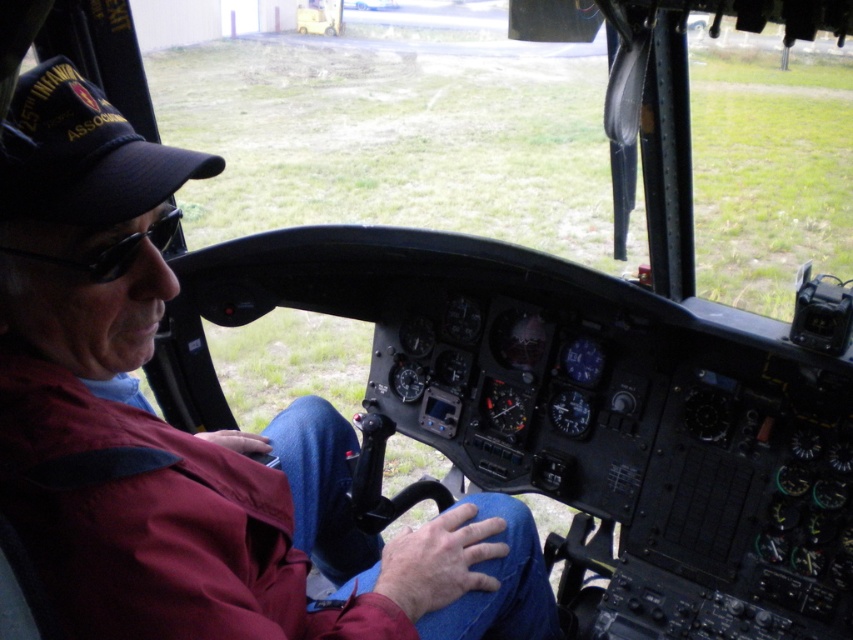
Based on the photo, does black fabric cap at upper left appear over black plastic goggles at left?

Yes, black fabric cap at upper left is above black plastic goggles at left.

Is black fabric cap at upper left positioned at the back of black plastic goggles at left?

That is False.

Identify the location of black fabric cap at upper left. (83, 154).

Where is `black fabric cap at upper left`? This screenshot has width=853, height=640. black fabric cap at upper left is located at coordinates (83, 154).